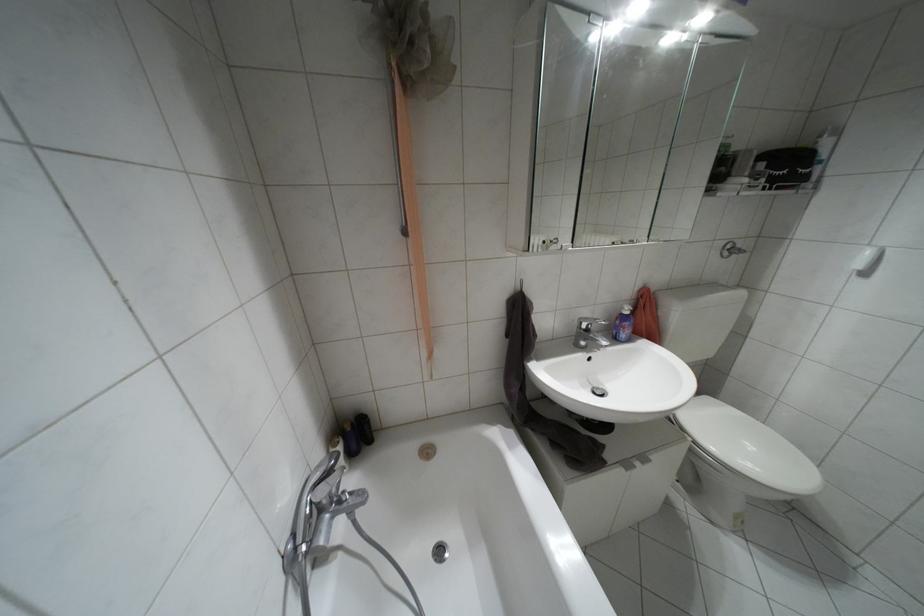
The height and width of the screenshot is (616, 924). Describe the element at coordinates (590, 323) in the screenshot. I see `a sink faucet handle` at that location.